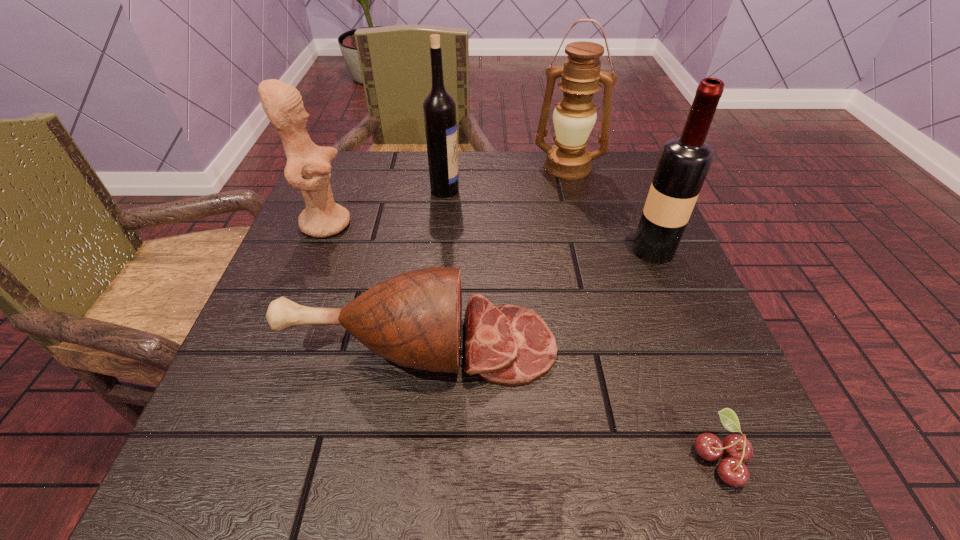
The height and width of the screenshot is (540, 960). Identify the location of oil lamp. (575, 115).

This screenshot has width=960, height=540. Find the location of `the second farthest object`. the second farthest object is located at coordinates (439, 108).

Find the location of a particular element. the farther wine bottle is located at coordinates (439, 108).

Find the location of a particular element. This screenshot has width=960, height=540. the right wine bottle is located at coordinates pyautogui.click(x=684, y=162).

Image resolution: width=960 pixels, height=540 pixels. What are the coordinates of `figurine` in the screenshot? It's located at (308, 166).

Find the location of a particular element. This screenshot has width=960, height=540. the second nearest object is located at coordinates (413, 319).

This screenshot has width=960, height=540. I want to click on the second shortest object, so [413, 319].

Identify the location of cherry. (732, 470).

Identify the location of the shortest object. Image resolution: width=960 pixels, height=540 pixels. (732, 470).

This screenshot has height=540, width=960. In order to click on free space located on the right of the farthest object in this screenshot , I will do `click(627, 167)`.